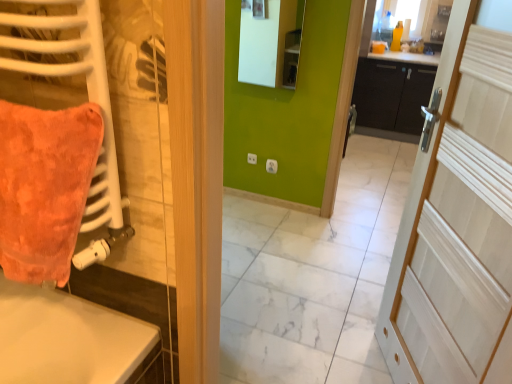
Question: Considering the relative sizes of white matte radiator at left and black matte cabinet at center in the image provided, is white matte radiator at left smaller than black matte cabinet at center?

Choices:
 (A) yes
 (B) no

Answer: (A)

Question: Is white matte radiator at left far away from black matte cabinet at center?

Choices:
 (A) no
 (B) yes

Answer: (B)

Question: From the image's perspective, is white matte radiator at left on black matte cabinet at center?

Choices:
 (A) yes
 (B) no

Answer: (B)

Question: From a real-world perspective, is white matte radiator at left under black matte cabinet at center?

Choices:
 (A) yes
 (B) no

Answer: (B)

Question: Is white matte radiator at left located outside black matte cabinet at center?

Choices:
 (A) yes
 (B) no

Answer: (A)

Question: Is the position of white matte radiator at left more distant than that of black matte cabinet at center?

Choices:
 (A) yes
 (B) no

Answer: (B)

Question: Is orange plush throw pillow at left smaller than white wood door at right?

Choices:
 (A) no
 (B) yes

Answer: (B)

Question: Is orange plush throw pillow at left further to the viewer compared to white wood door at right?

Choices:
 (A) yes
 (B) no

Answer: (A)

Question: Is orange plush throw pillow at left facing towards white wood door at right?

Choices:
 (A) no
 (B) yes

Answer: (A)

Question: Would you say white wood door at right is part of orange plush throw pillow at left's contents?

Choices:
 (A) no
 (B) yes

Answer: (A)

Question: Is orange plush throw pillow at left closer to camera compared to white wood door at right?

Choices:
 (A) no
 (B) yes

Answer: (A)

Question: Can you confirm if orange plush throw pillow at left is positioned to the right of white wood door at right?

Choices:
 (A) yes
 (B) no

Answer: (B)

Question: Is matte white mirror at upper center at the back of orange plush throw pillow at left?

Choices:
 (A) yes
 (B) no

Answer: (A)